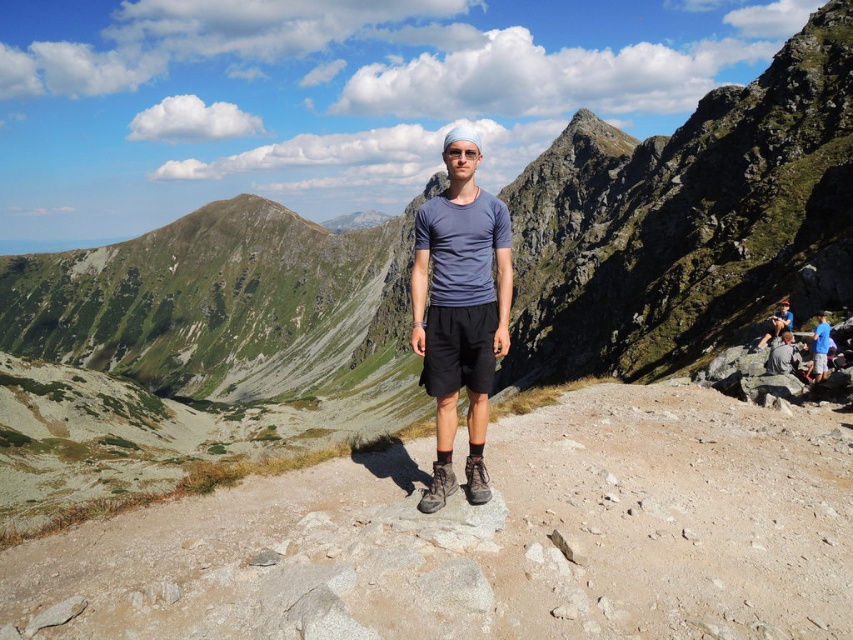
Question: Based on their relative distances, which object is farther from the blue fabric shirt at center?

Choices:
 (A) blue fabric shirt at right
 (B) matte blue t-shirt at center

Answer: (B)

Question: Which of the following is the closest to the observer?

Choices:
 (A) blue fabric shirt at right
 (B) matte blue t-shirt at center

Answer: (B)

Question: Among these objects, which one is farthest from the camera?

Choices:
 (A) matte blue t-shirt at center
 (B) blue fabric shirt at center

Answer: (B)

Question: Can you confirm if matte blue t-shirt at center is positioned to the left of blue fabric shirt at right?

Choices:
 (A) yes
 (B) no

Answer: (A)

Question: In this image, where is matte blue t-shirt at center located relative to blue fabric shirt at center?

Choices:
 (A) below
 (B) above

Answer: (B)

Question: Is blue fabric shirt at right bigger than blue fabric shirt at center?

Choices:
 (A) no
 (B) yes

Answer: (A)